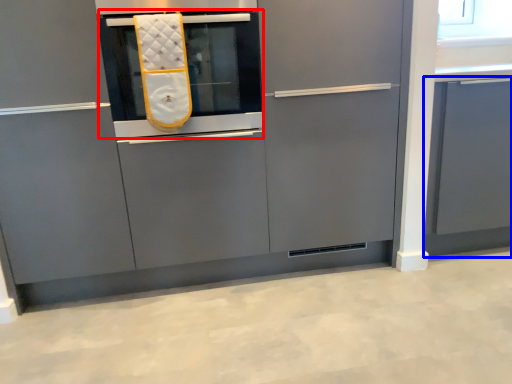
Question: Which object appears farthest to the camera in this image, oven (highlighted by a red box) or cabinetry (highlighted by a blue box)?

Choices:
 (A) oven
 (B) cabinetry

Answer: (B)